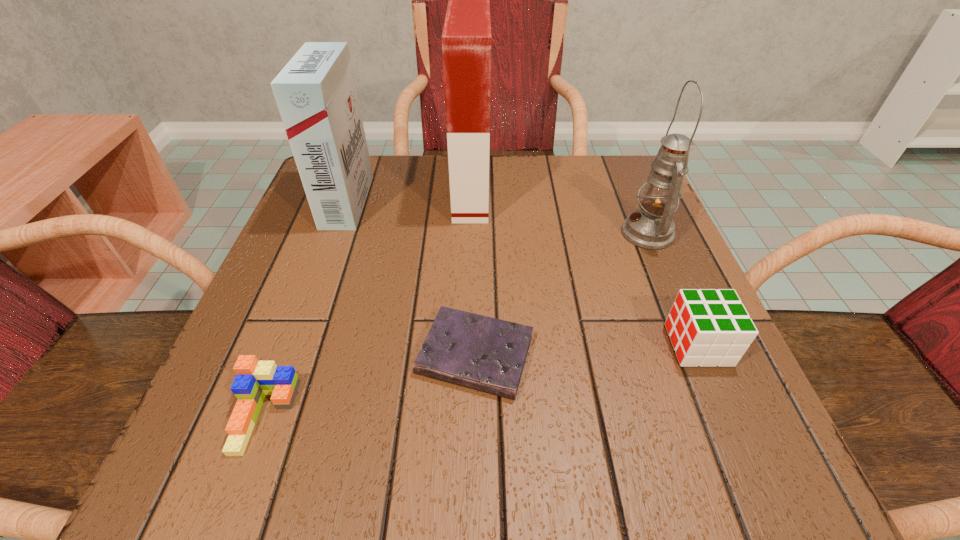
What are the coordinates of `vacant area that lies between the right cigarette case and the shortest object` in the screenshot? It's located at (473, 273).

I want to click on free spot between the oil lamp and the shorter cigarette case, so click(x=497, y=218).

Identify the location of unoccupied position between the fourth tallest object and the oil lamp. Image resolution: width=960 pixels, height=540 pixels. (673, 289).

Find the location of a particular element. The width and height of the screenshot is (960, 540). free space that is in between the right cigarette case and the cube is located at coordinates (585, 268).

You are a GUI agent. You are given a task and a screenshot of the screen. Output one action in this format:
    pyautogui.click(x=<x>, y=<y>)
    Task: Click on the free spot between the diary and the taller cigarette case
    The height and width of the screenshot is (540, 960).
    Given the screenshot: What is the action you would take?
    pyautogui.click(x=473, y=273)

Image resolution: width=960 pixels, height=540 pixels. I want to click on object that is the fifth closest to the diary, so pyautogui.click(x=316, y=95).

Locate an element on the screen. object that is the fourth nearest to the left cigarette case is located at coordinates (651, 227).

The height and width of the screenshot is (540, 960). I want to click on free space that satisfies the following two spatial constraints: 1. on the front-facing side of the right cigarette case; 2. on the left side of the oil lamp, so point(469,233).

Identify the location of vacant region that satisfies the following two spatial constraints: 1. on the red face of the cube; 2. on the front side of the shortest object. (703, 355).

Image resolution: width=960 pixels, height=540 pixels. I want to click on blank area in the image that satisfies the following two spatial constraints: 1. on the front side of the oil lamp; 2. on the right side of the shorter cigarette case, so [x=336, y=233].